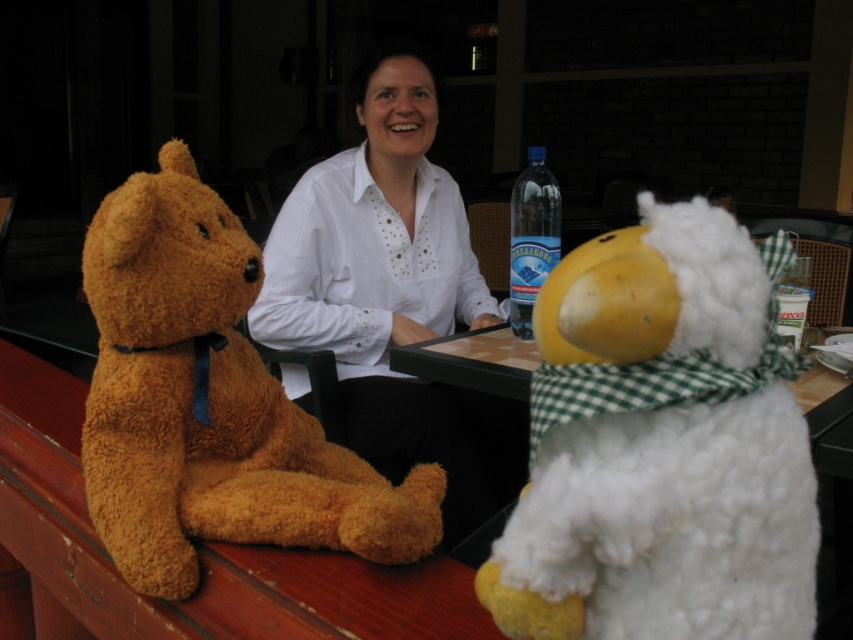
Question: Does fuzzy brown teddy bear at left have a larger size compared to white matte shirt at center?

Choices:
 (A) no
 (B) yes

Answer: (A)

Question: Does white matte shirt at center appear over blue plastic bottle at upper center?

Choices:
 (A) no
 (B) yes

Answer: (A)

Question: Which of these objects is positioned farthest from the white fluffy stuffed animal at right?

Choices:
 (A) fuzzy brown teddy bear at left
 (B) blue plastic bottle at upper center
 (C) white matte shirt at center

Answer: (C)

Question: Does white fluffy stuffed animal at right appear on the right side of fuzzy brown teddy bear at left?

Choices:
 (A) no
 (B) yes

Answer: (B)

Question: Which of the following is the closest to the observer?

Choices:
 (A) fuzzy brown teddy bear at left
 (B) white matte shirt at center
 (C) blue plastic bottle at upper center
 (D) white fluffy stuffed animal at right

Answer: (D)

Question: Which object is positioned closest to the white matte shirt at center?

Choices:
 (A) blue plastic bottle at upper center
 (B) fuzzy brown teddy bear at left

Answer: (A)